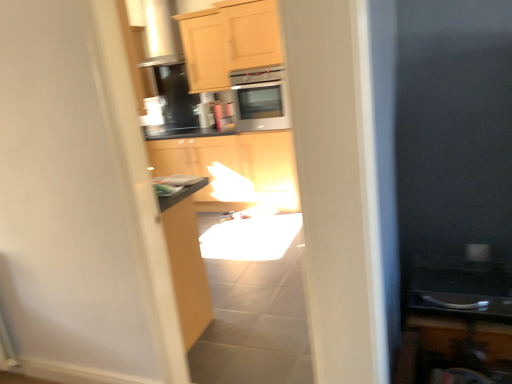
Question: Is wooden cabinet at lower right, which is the third cabinetry from left to right, facing away from satin silver microwave at center?

Choices:
 (A) no
 (B) yes

Answer: (A)

Question: Is wooden cabinet at lower right, which is the first cabinetry in front-to-back order, bigger than satin silver microwave at center?

Choices:
 (A) yes
 (B) no

Answer: (B)

Question: From the image's perspective, is wooden cabinet at lower right, which is the 3th cabinetry from top to bottom, below satin silver microwave at center?

Choices:
 (A) yes
 (B) no

Answer: (A)

Question: Is wooden cabinet at lower right, the third cabinetry in the back-to-front sequence, taller than satin silver microwave at center?

Choices:
 (A) yes
 (B) no

Answer: (B)

Question: Can you confirm if wooden cabinet at lower right, which is the first cabinetry in front-to-back order, is shorter than satin silver microwave at center?

Choices:
 (A) no
 (B) yes

Answer: (B)

Question: From the image's perspective, is satin silver microwave at center positioned above or below wooden cabinet at lower right, the third cabinetry in the back-to-front sequence?

Choices:
 (A) above
 (B) below

Answer: (A)

Question: Relative to wooden cabinet at lower right, which is the 3th cabinetry from top to bottom, is satin silver microwave at center in front or behind?

Choices:
 (A) behind
 (B) front

Answer: (A)

Question: Considering the positions of satin silver microwave at center and wooden cabinet at lower right, the third cabinetry in the back-to-front sequence, in the image, is satin silver microwave at center wider or thinner than wooden cabinet at lower right, the third cabinetry in the back-to-front sequence,?

Choices:
 (A) thin
 (B) wide

Answer: (B)

Question: From a real-world perspective, is satin silver microwave at center above or below wooden cabinet at lower right, the first cabinetry from the bottom?

Choices:
 (A) above
 (B) below

Answer: (A)

Question: In terms of width, does wooden cabinet at lower right, the third cabinetry in the back-to-front sequence, look wider or thinner when compared to light wood cabinet at upper center, acting as the 2th cabinetry starting from the front?

Choices:
 (A) wide
 (B) thin

Answer: (A)

Question: In terms of height, does wooden cabinet at lower right, which is the first cabinetry in front-to-back order, look taller or shorter compared to light wood cabinet at upper center, placed as the second cabinetry when sorted from right to left?

Choices:
 (A) short
 (B) tall

Answer: (A)

Question: Do you think wooden cabinet at lower right, which is the third cabinetry from left to right, is within light wood cabinet at upper center, which is the 3th cabinetry from bottom to top, or outside of it?

Choices:
 (A) inside
 (B) outside

Answer: (B)

Question: From a real-world perspective, is wooden cabinet at lower right, which is the third cabinetry from left to right, above or below light wood cabinet at upper center, the second cabinetry positioned from the left?

Choices:
 (A) below
 (B) above

Answer: (A)

Question: Is point (182, 21) closer or farther from the camera than point (174, 170)?

Choices:
 (A) farther
 (B) closer

Answer: (B)

Question: From a real-world perspective, is light wood cabinet at upper center, which is the 3th cabinetry from bottom to top, above or below matte wood cabinet at center, marked as the 1th cabinetry in a back-to-front arrangement?

Choices:
 (A) above
 (B) below

Answer: (A)